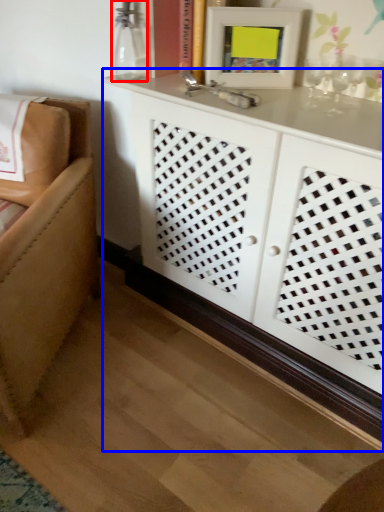
Question: Which object is closer to the camera taking this photo, glass vase (highlighted by a red box) or cabinetry (highlighted by a blue box)?

Choices:
 (A) glass vase
 (B) cabinetry

Answer: (B)